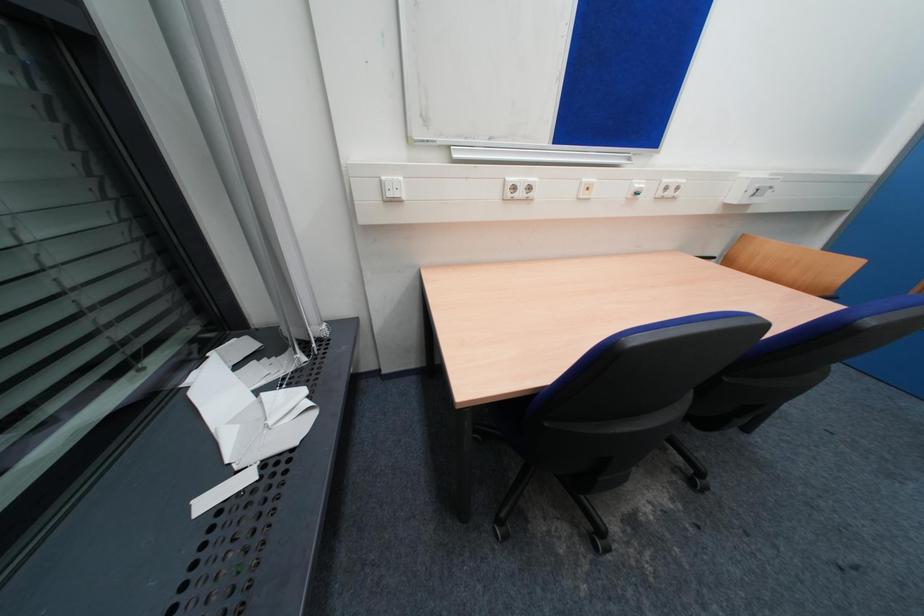
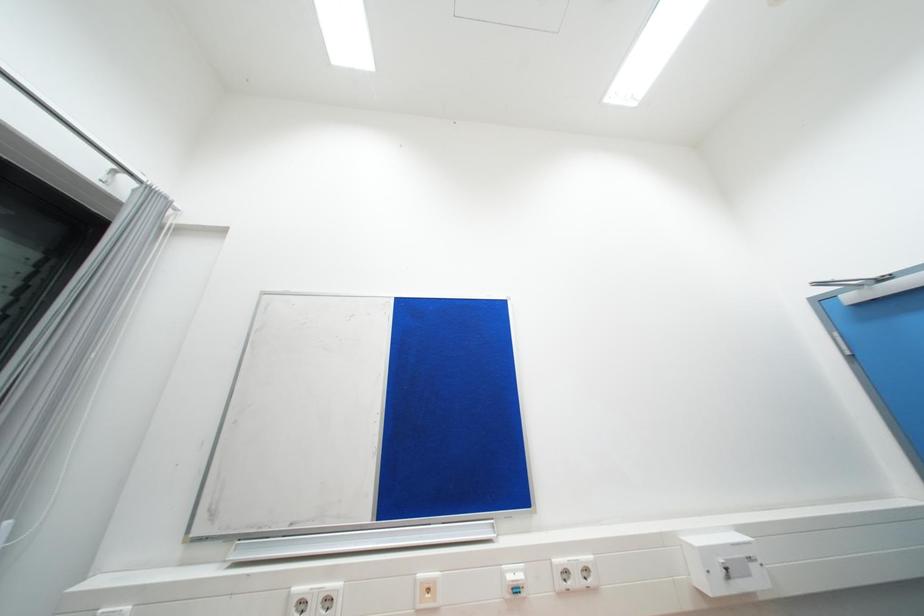
Question: Based on the continuous images, in which direction is the camera rotating? Reply with the corresponding letter.

Choices:
 (A) Left
 (B) Right
 (C) Up
 (D) Down

Answer: (C)